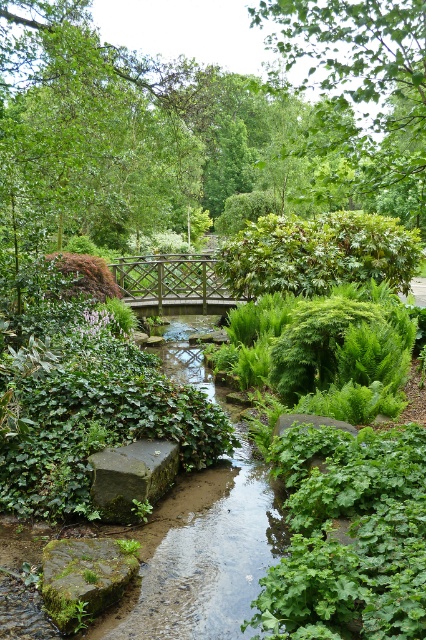
Question: Does green leafy tree at upper center appear under green mossy stone at center?

Choices:
 (A) no
 (B) yes

Answer: (A)

Question: Can you confirm if green leafy tree at upper center is thinner than wooden lattice bridge at center?

Choices:
 (A) yes
 (B) no

Answer: (B)

Question: Which is nearer to the green mossy stone at center?

Choices:
 (A) gray stone at center
 (B) wooden lattice bridge at center
 (C) green mossy rock at lower left

Answer: (A)

Question: Which object is farther from the camera taking this photo?

Choices:
 (A) green leafy tree at upper center
 (B) wooden lattice bridge at center

Answer: (B)

Question: Which point appears farthest from the camera in this image?

Choices:
 (A) (83, 566)
 (B) (278, 417)
 (C) (322, 116)

Answer: (B)

Question: Is gray stone at center to the left of green mossy stone at center from the viewer's perspective?

Choices:
 (A) yes
 (B) no

Answer: (A)